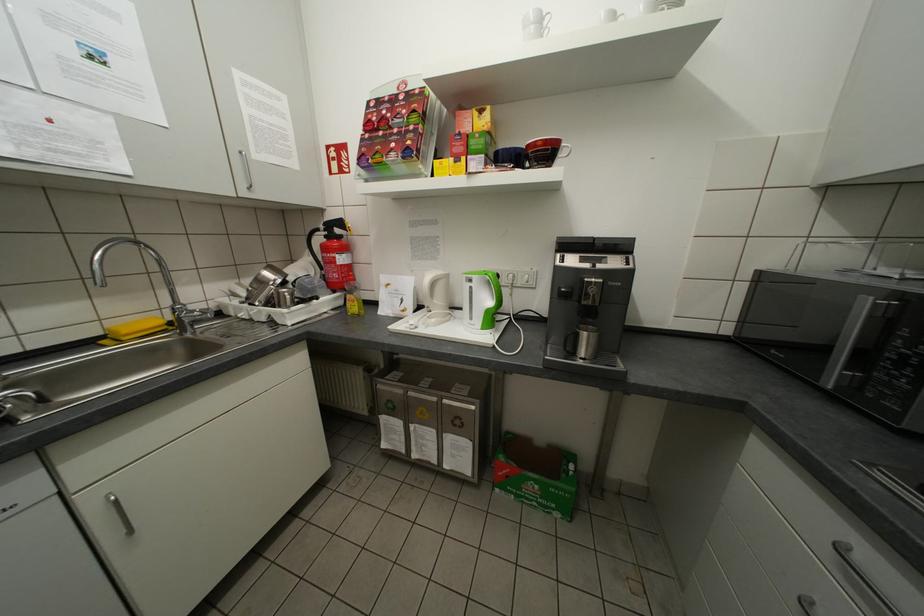
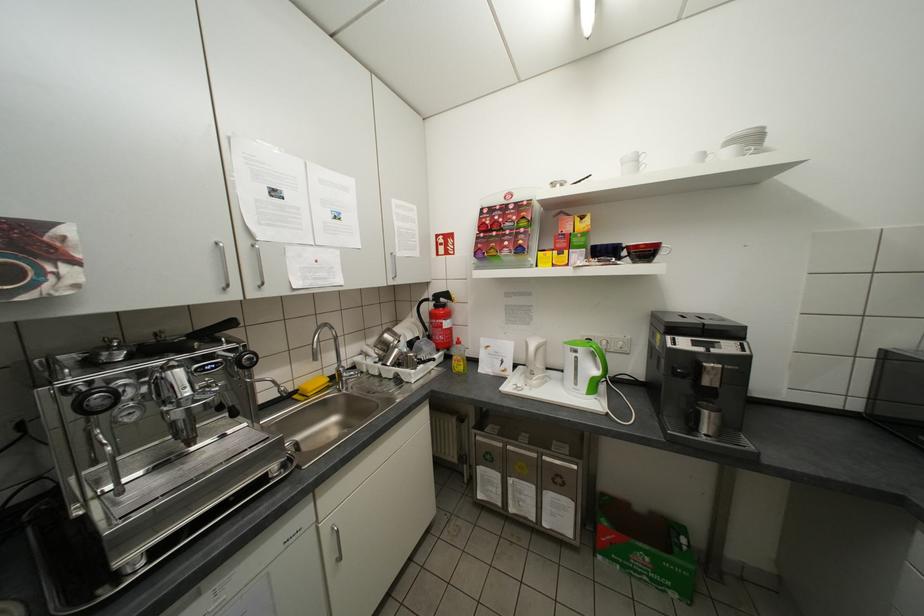
In the second image, find the point that corresponds to [175,322] in the first image.

(336, 379)